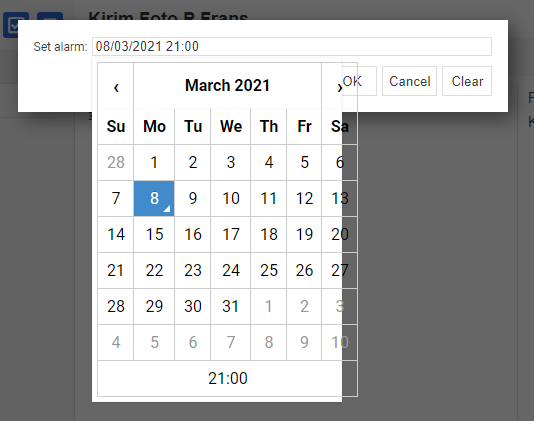
This screenshot has height=421, width=534. I want to click on alarm, so click(x=73, y=46).